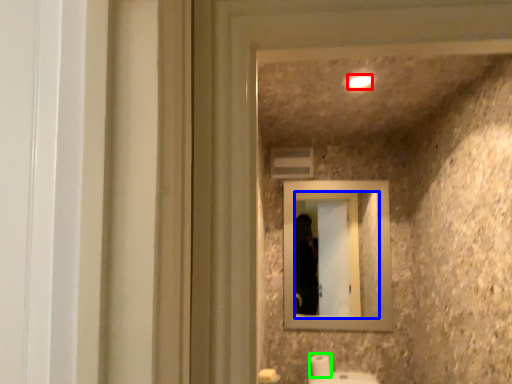
Question: Which object is positioned farthest from light (highlighted by a red box)? Select from mirror (highlighted by a blue box) and toilet paper (highlighted by a green box).

Choices:
 (A) mirror
 (B) toilet paper

Answer: (A)